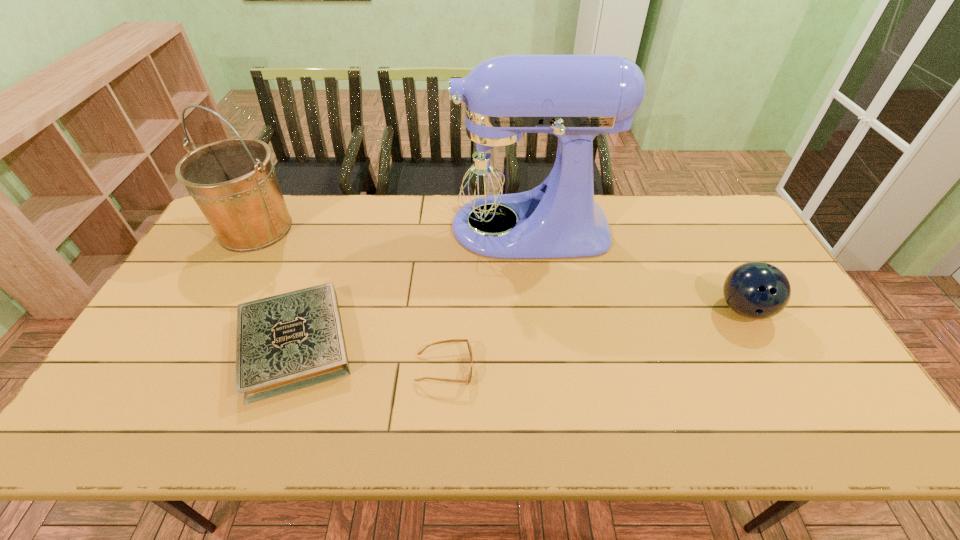
Where is `the tallest object`? the tallest object is located at coordinates (494, 168).

I want to click on the second tallest object, so click(233, 181).

At what (x,y) coordinates should I click in order to perform the action: click on the third tallest object. Please return your answer as a coordinate pair (x, y). The width and height of the screenshot is (960, 540). Looking at the image, I should click on (756, 290).

Locate an element on the screen. This screenshot has height=540, width=960. the rightmost object is located at coordinates (756, 290).

Locate an element on the screen. Image resolution: width=960 pixels, height=540 pixels. hardback book is located at coordinates (294, 340).

Where is `sunglasses`? This screenshot has width=960, height=540. sunglasses is located at coordinates (468, 380).

The height and width of the screenshot is (540, 960). Find the location of `vacant space situated at the mixing area of the mixer`. vacant space situated at the mixing area of the mixer is located at coordinates (324, 227).

Identify the location of free space located 0.390m at the mixing area of the mixer. This screenshot has width=960, height=540. (324, 227).

Find the location of a particular element. The height and width of the screenshot is (540, 960). free space located 0.390m at the mixing area of the mixer is located at coordinates (324, 227).

Identify the location of vacant region located 0.140m on the right of the fourth shortest object. (339, 228).